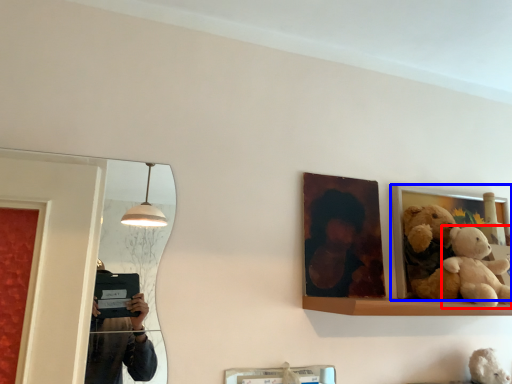
Question: Among these objects, which one is nearest to the camera, teddy bear (highlighted by a red box) or picture frame (highlighted by a blue box)?

Choices:
 (A) teddy bear
 (B) picture frame

Answer: (A)